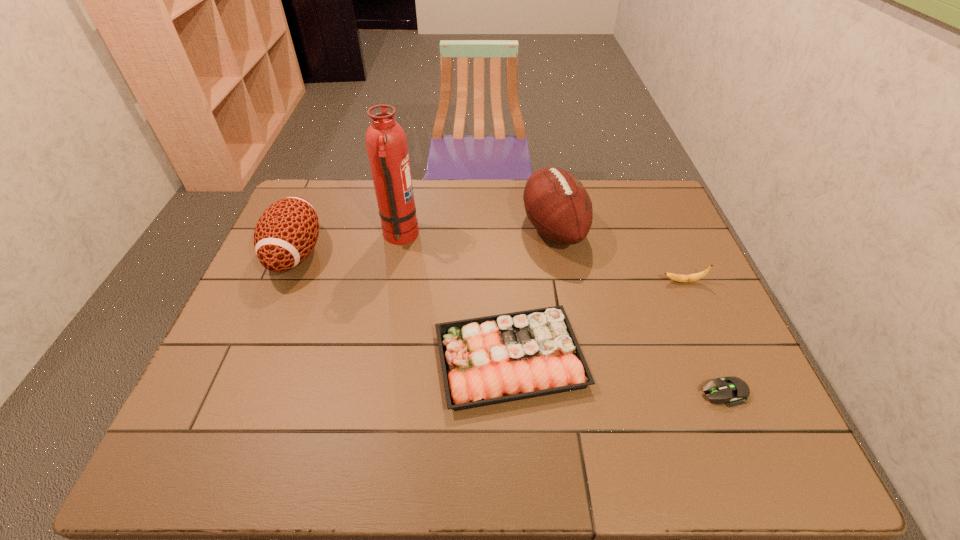
I want to click on banana that is positioned at the right edge, so click(x=696, y=276).

This screenshot has width=960, height=540. Identify the location of computer mouse located in the right edge section of the desktop. (733, 390).

At what (x,y) coordinates should I click in order to perform the action: click on blank space at the far edge. Please return your answer as a coordinate pair (x, y). Looking at the image, I should click on (424, 183).

This screenshot has height=540, width=960. In order to click on vacant space at the near edge of the desktop in this screenshot , I will do `click(351, 455)`.

What are the coordinates of `vacant area at the left edge of the desktop` in the screenshot? It's located at (284, 336).

Where is `free region at the right edge of the desktop`? The height and width of the screenshot is (540, 960). free region at the right edge of the desktop is located at coordinates (x=685, y=244).

You are a GUI agent. You are given a task and a screenshot of the screen. Output one action in this format:
    pyautogui.click(x=<x>, y=<y>)
    Task: Click on the vacant space at the near left corner
    
    Given the screenshot: What is the action you would take?
    pyautogui.click(x=223, y=449)

Find the location of a particular element. vacant space at the far right corner of the desktop is located at coordinates (635, 181).

In the image, there is a desktop. Where is `free space at the near right corner`? The image size is (960, 540). free space at the near right corner is located at coordinates (767, 434).

Where is `vacant area that lies between the shortest object and the right football`? vacant area that lies between the shortest object and the right football is located at coordinates (638, 310).